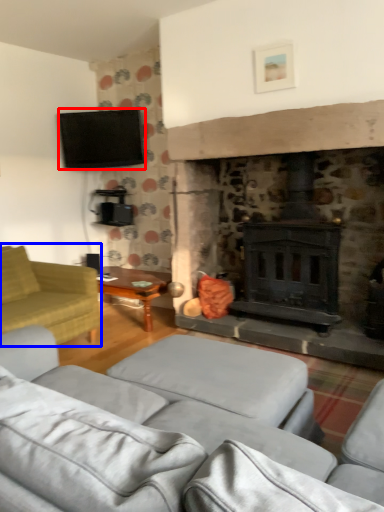
Question: Among these objects, which one is farthest to the camera, television (highlighted by a red box) or studio couch (highlighted by a blue box)?

Choices:
 (A) television
 (B) studio couch

Answer: (A)